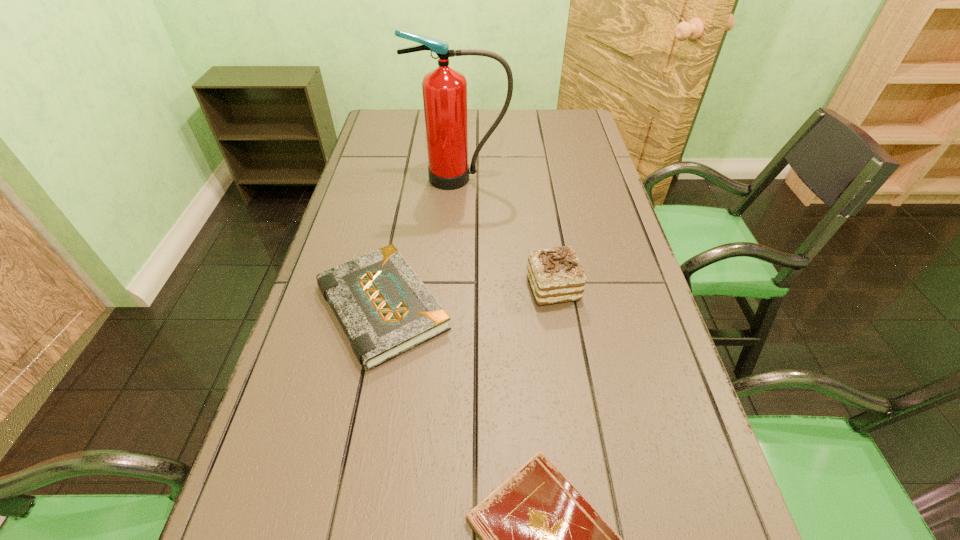
Where is `the tallest object`? The width and height of the screenshot is (960, 540). the tallest object is located at coordinates (444, 89).

You are a GUI agent. You are given a task and a screenshot of the screen. Output one action in this format:
    pyautogui.click(x=<x>, y=<y>)
    Task: Click on the fire extinguisher
    
    Given the screenshot: What is the action you would take?
    pyautogui.click(x=444, y=89)

Where is `the second tallest object`? The width and height of the screenshot is (960, 540). the second tallest object is located at coordinates (555, 274).

You are a GUI agent. You are given a task and a screenshot of the screen. Output one action in this format:
    pyautogui.click(x=<x>, y=<y>)
    Task: Click on the third tallest object
    This screenshot has width=960, height=540.
    Given the screenshot: What is the action you would take?
    pyautogui.click(x=384, y=308)

Locate an element on the screen. Image resolution: width=960 pixels, height=540 pixels. the taller notebook is located at coordinates [384, 308].

This screenshot has width=960, height=540. Find the location of `vacant region located 0.250m on the back of the farthest object`. vacant region located 0.250m on the back of the farthest object is located at coordinates (464, 130).

The height and width of the screenshot is (540, 960). I want to click on vacant space located 0.210m on the left of the second tallest object, so click(438, 288).

Identify the location of vacant point located 0.160m on the right of the taller notebook. This screenshot has height=540, width=960. (522, 307).

The height and width of the screenshot is (540, 960). I want to click on object that is at the left edge, so click(384, 308).

You are a GUI agent. You are given a task and a screenshot of the screen. Output one action in this format:
    pyautogui.click(x=<x>, y=<y>)
    Task: Click on the object positioned at the right edge
    This screenshot has width=960, height=540.
    Given the screenshot: What is the action you would take?
    pyautogui.click(x=555, y=274)